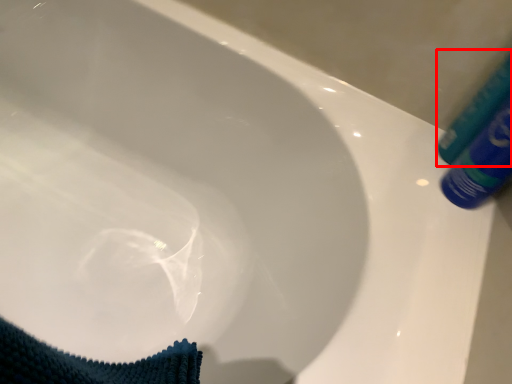
Question: From the image's perspective, what is the correct spatial positioning of tube (annotated by the red box) in reference to tube?

Choices:
 (A) above
 (B) below

Answer: (A)